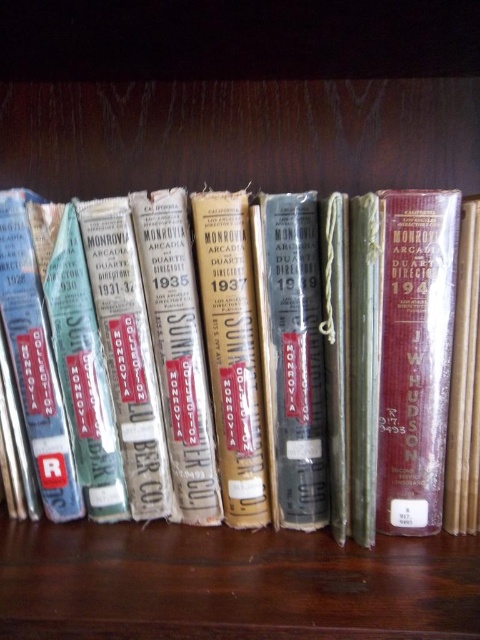
Question: Does wooden shelf at center appear on the right side of hardcover book at center?

Choices:
 (A) no
 (B) yes

Answer: (A)

Question: Is wooden shelf at center wider than hardcover book at center?

Choices:
 (A) yes
 (B) no

Answer: (A)

Question: Considering the relative positions of wooden shelf at center and hardcover book at center in the image provided, where is wooden shelf at center located with respect to hardcover book at center?

Choices:
 (A) above
 (B) below

Answer: (B)